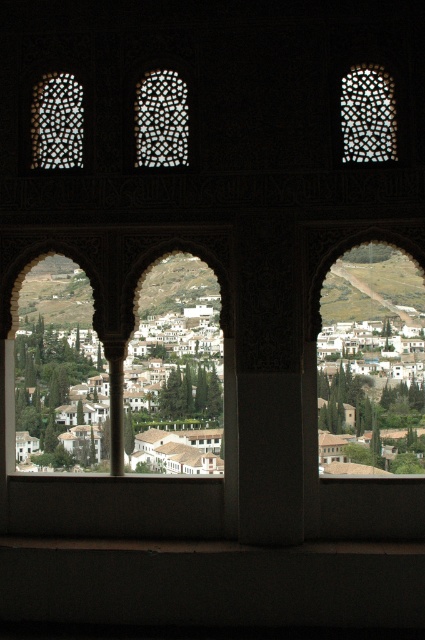
Is white textured buildings at center above translucent mosaic tile at upper left?

No.

Between point (99, 381) and point (44, 148), which one is positioned in front?

Positioned in front is point (44, 148).

Is point (146, 417) positioned in front of point (53, 134)?

No, (146, 417) is behind (53, 134).

Where is `white textured buildings at center`? white textured buildings at center is located at coordinates (61, 396).

Does white textured buildings at center have a lesser height compared to translucent mosaic tile at center?

In fact, white textured buildings at center may be taller than translucent mosaic tile at center.

Where is `white textured buildings at center`? Image resolution: width=425 pixels, height=640 pixels. white textured buildings at center is located at coordinates (61, 396).

The image size is (425, 640). I want to click on white mosaic tile at upper right, so click(368, 115).

Where is `white mosaic tile at upper right`? Image resolution: width=425 pixels, height=640 pixels. white mosaic tile at upper right is located at coordinates (368, 115).